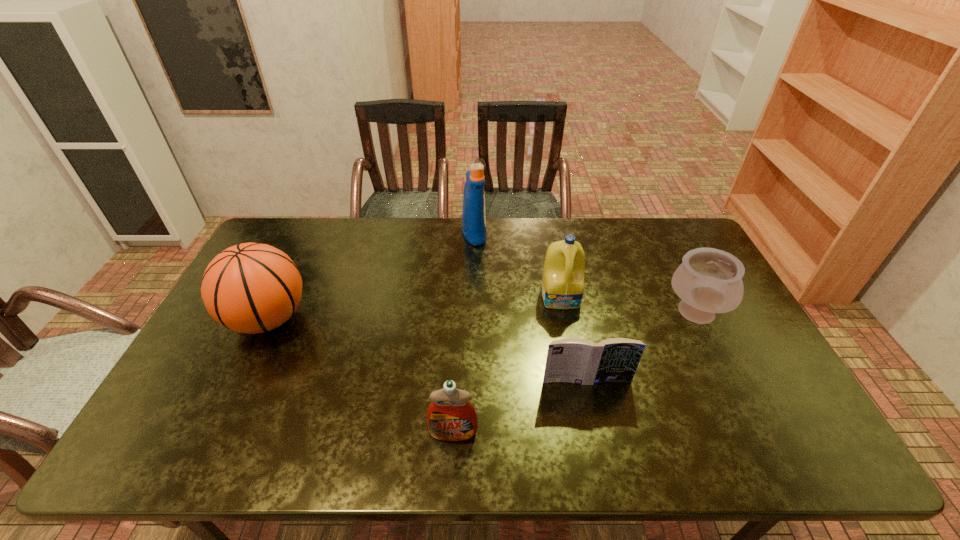
You are a GUI agent. You are given a task and a screenshot of the screen. Output one action in this format:
    pyautogui.click(x=<x>, y=<y>)
    Task: Click on the vacant space situated on the back of the basketball
    This screenshot has width=960, height=540.
    Given the screenshot: What is the action you would take?
    pyautogui.click(x=290, y=273)

Where is `free spot located on the label of the rightmost detergent`? The image size is (960, 540). free spot located on the label of the rightmost detergent is located at coordinates (566, 323).

Where is `vacant space located on the back of the rightmost object`? This screenshot has height=540, width=960. vacant space located on the back of the rightmost object is located at coordinates (659, 238).

At what (x,y) coordinates should I click in order to perform the action: click on blank area located 0.050m on the front cover of the book. Please return your answer as a coordinate pair (x, y). The height and width of the screenshot is (540, 960). Looking at the image, I should click on (591, 402).

Locate an element on the screen. This screenshot has width=960, height=540. object situated at the far edge is located at coordinates (473, 213).

Where is `object that is at the near edge`? This screenshot has height=540, width=960. object that is at the near edge is located at coordinates (451, 417).

Locate an element on the screen. This screenshot has height=540, width=960. object that is at the left edge is located at coordinates (252, 288).

Where is `object located in the right edge section of the desktop`? object located in the right edge section of the desktop is located at coordinates (709, 281).

This screenshot has height=540, width=960. I want to click on blank space at the far edge of the desktop, so point(380,231).

In the image, there is a desktop. At what (x,y) coordinates should I click in order to perform the action: click on blank space at the near edge. Please return your answer as a coordinate pair (x, y). Looking at the image, I should click on (599, 462).